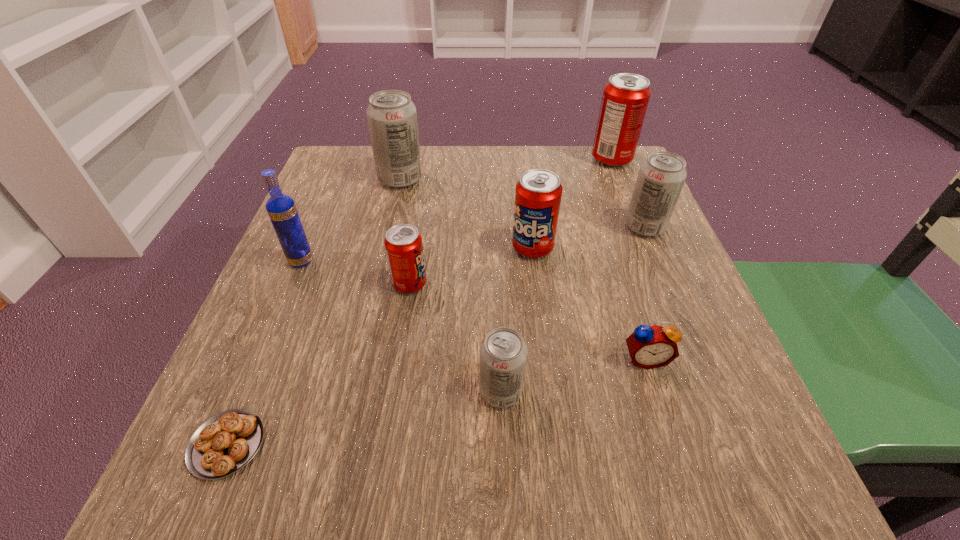
You are a GUI agent. You are given a task and a screenshot of the screen. Output one action in this format:
    pyautogui.click(x=<x>, y=<y>)
    Task: Click on the vacant region located 0.300m on the left of the second farthest red soda can
    
    Given the screenshot: What is the action you would take?
    pyautogui.click(x=360, y=247)

Where is `blank area located 0.300m on the front of the leftmost red soda can`? blank area located 0.300m on the front of the leftmost red soda can is located at coordinates (381, 469).

Find the location of `vacant space located on the back of the second gray soda can from right to left`. vacant space located on the back of the second gray soda can from right to left is located at coordinates (498, 330).

The width and height of the screenshot is (960, 540). In order to click on free point located 0.180m on the front-facing side of the red alarm clock in this screenshot , I will do `click(688, 495)`.

Locate an element on the screen. This screenshot has width=960, height=540. vacant space located 0.130m on the right of the shortest object is located at coordinates (361, 444).

Image resolution: width=960 pixels, height=540 pixels. What are the coordinates of `object located at the near edge` in the screenshot? It's located at (225, 443).

Find the location of a particular element. soda can present at the left edge is located at coordinates (392, 117).

Image resolution: width=960 pixels, height=540 pixels. What are the coordinates of `vodka at the left edge` in the screenshot? It's located at (282, 211).

At what (x,y) coordinates should I click in order to perform the action: click on pastry that is positioned at the left edge. Please return your answer as a coordinate pair (x, y). This screenshot has width=960, height=540. Looking at the image, I should click on (225, 443).

Where is `alarm clock that is at the right edge`? This screenshot has width=960, height=540. alarm clock that is at the right edge is located at coordinates (654, 346).